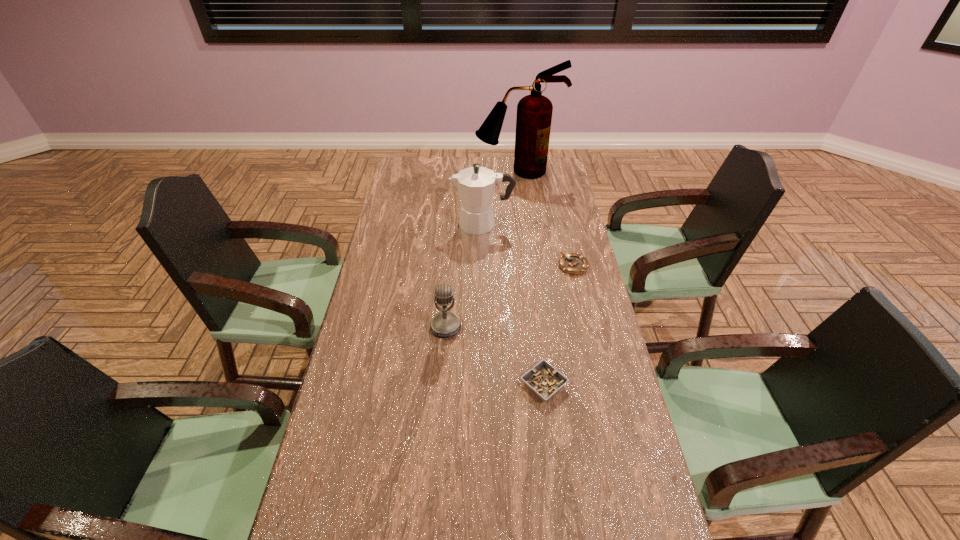
Find the location of a particular element. The height and width of the screenshot is (540, 960). free space between the third shortest object and the right ashtray is located at coordinates (510, 296).

Image resolution: width=960 pixels, height=540 pixels. Find the location of `empty space that is in between the fourth nearest object and the third tallest object`. empty space that is in between the fourth nearest object and the third tallest object is located at coordinates (465, 276).

This screenshot has height=540, width=960. Find the location of `object that stands as the closest to the second tallest object`. object that stands as the closest to the second tallest object is located at coordinates (572, 263).

Locate which object is the third closest to the nearest object. Please provide its 2D coordinates. Your answer should be formatted as a tuple, i.e. [(x, y)], where the tuple contains the x and y coordinates of a point satisfying the conditions above.

[(476, 185)]

Identify which ashtray is the closest to the coffeepot. Please provide its 2D coordinates. Your answer should be formatted as a tuple, i.e. [(x, y)], where the tuple contains the x and y coordinates of a point satisfying the conditions above.

[(572, 263)]

Image resolution: width=960 pixels, height=540 pixels. What are the coordinates of `ashtray that can be found as the closest to the fourth farthest object` in the screenshot? It's located at (544, 380).

The height and width of the screenshot is (540, 960). I want to click on vacant space that satisfies the following two spatial constraints: 1. at the spout of the nearer ashtray; 2. on the right side of the fourth nearest object, so 484,384.

Where is `free spot that satisfies the following two spatial constraints: 1. at the nozzle of the tallest object; 2. on the left side of the third farthest object`? free spot that satisfies the following two spatial constraints: 1. at the nozzle of the tallest object; 2. on the left side of the third farthest object is located at coordinates (529, 266).

Locate an element on the screen. blank space that satisfies the following two spatial constraints: 1. at the nozzle of the tallest object; 2. on the left side of the right ashtray is located at coordinates (529, 266).

This screenshot has width=960, height=540. I want to click on free space that satisfies the following two spatial constraints: 1. at the spout of the fourth nearest object; 2. on the right side of the farther ashtray, so click(x=483, y=266).